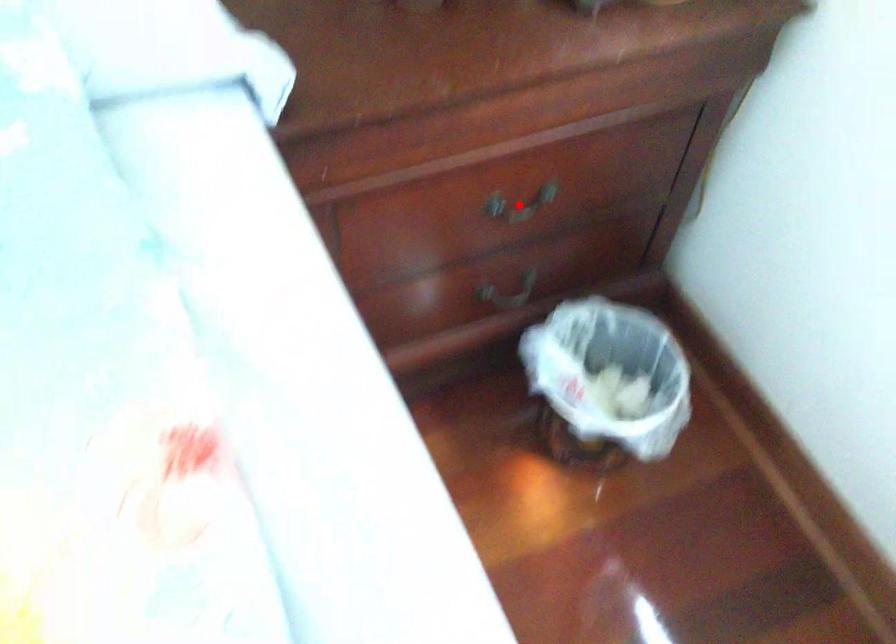
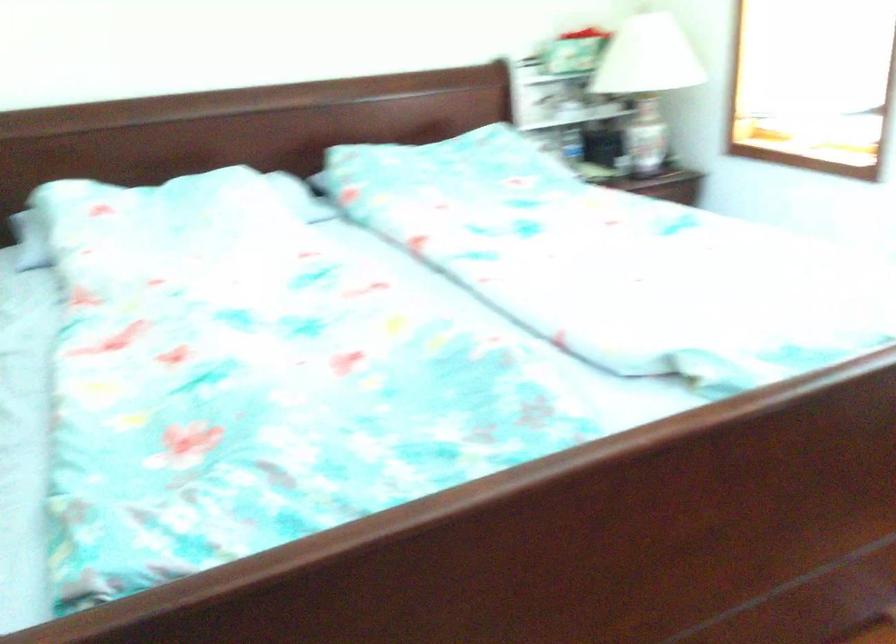
Question: I am providing you with two images of the same scene from different viewpoints. A red point is marked on the first image. At the location where the point appears in image 1, is it still visible in image 2?

Choices:
 (A) Yes
 (B) No

Answer: (B)